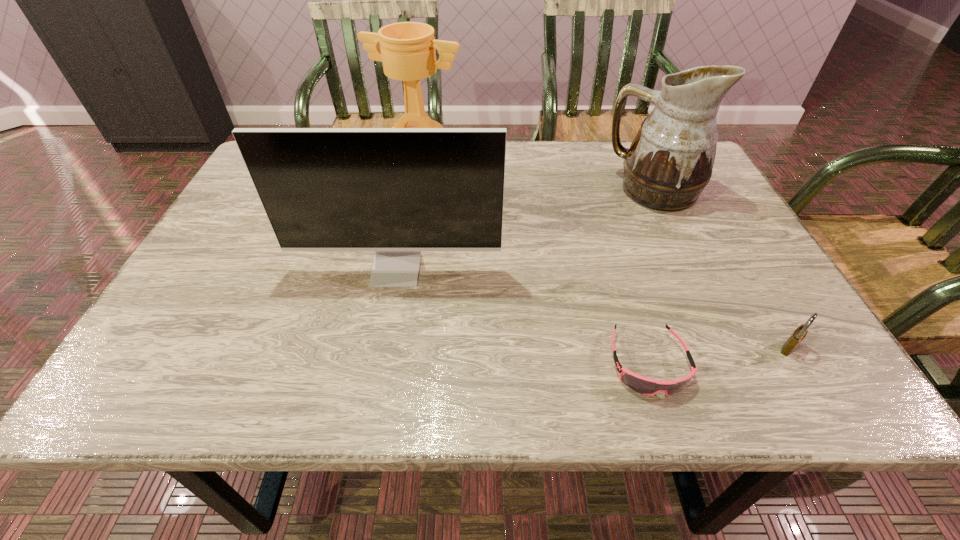
This screenshot has width=960, height=540. In order to click on vacant space located on the left of the padlock in this screenshot , I will do `click(744, 348)`.

Locate an element on the screen. This screenshot has height=540, width=960. award that is positioned at the far edge is located at coordinates (408, 49).

Locate an element on the screen. pitcher at the far edge is located at coordinates (670, 160).

You are a GUI agent. You are given a task and a screenshot of the screen. Output one action in this format:
    pyautogui.click(x=<x>, y=<y>)
    Task: Click on the object that is at the near edge
    The width and height of the screenshot is (960, 540).
    Given the screenshot: What is the action you would take?
    pyautogui.click(x=646, y=386)

I want to click on pitcher that is at the right edge, so click(x=670, y=160).

This screenshot has width=960, height=540. What are the coordinates of `padlock at the right edge` in the screenshot? It's located at (799, 334).

Identify the location of object located at the far right corner. This screenshot has width=960, height=540. (670, 160).

The width and height of the screenshot is (960, 540). In the image, there is a desktop. What are the coordinates of `vacant space at the far edge` in the screenshot? It's located at (537, 177).

In the image, there is a desktop. Identify the location of vacant area at the near edge. This screenshot has width=960, height=540. (387, 360).

Find the location of a particular element. This screenshot has width=960, height=540. vacant area at the left edge of the desktop is located at coordinates (238, 259).